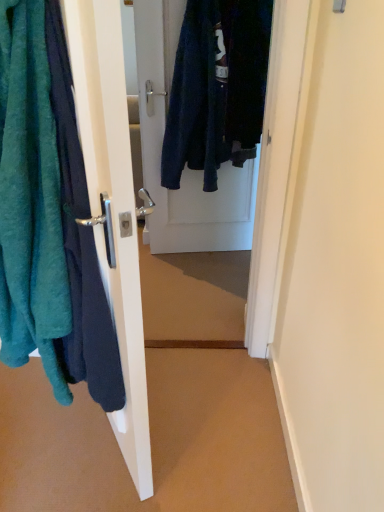
The width and height of the screenshot is (384, 512). Identify the location of free space in front of velvet dark blue coat at center, acting as the 2th door starting from the front. (196, 280).